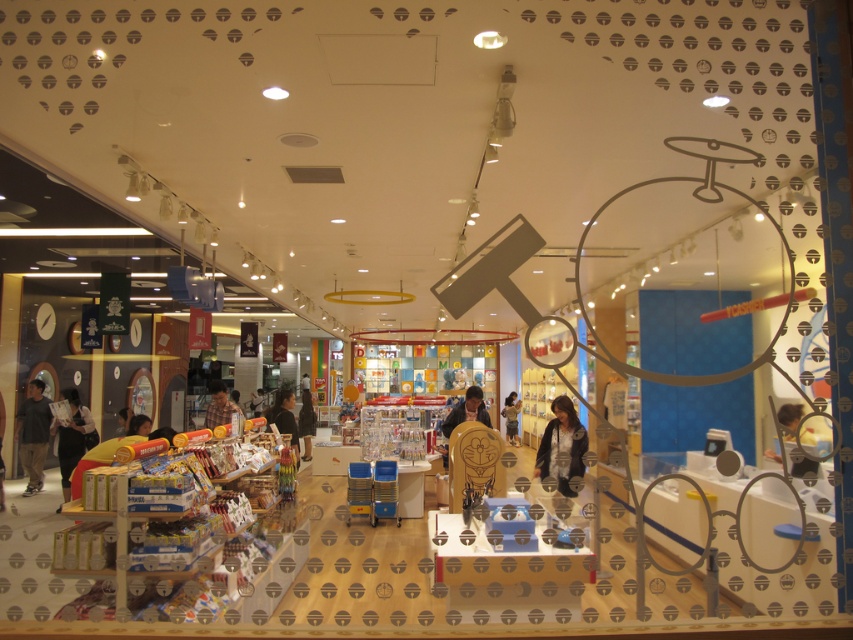
Question: Which object is farther from the camera taking this photo?

Choices:
 (A) dark brown hair at center
 (B) matte yellow toy at lower left
 (C) black matte dress at center
 (D) light brown shirt at center

Answer: (C)

Question: Does light brown shirt at center have a larger size compared to light brown fabric shirt at center?

Choices:
 (A) no
 (B) yes

Answer: (B)

Question: Which object is the closest to the dark gray fabric shirt at lower left?

Choices:
 (A) dark gray cotton pants at lower left
 (B) black matte dress at center
 (C) black matte shirt at center

Answer: (A)

Question: Does dark gray fabric shirt at lower left come behind smooth beige shirt at center?

Choices:
 (A) yes
 (B) no

Answer: (A)

Question: Is dark gray fabric shirt at lower left wider than black matte shirt at center?

Choices:
 (A) yes
 (B) no

Answer: (B)

Question: Which point appears closest to the camera in this image?

Choices:
 (A) (482, 410)
 (B) (22, 428)

Answer: (A)